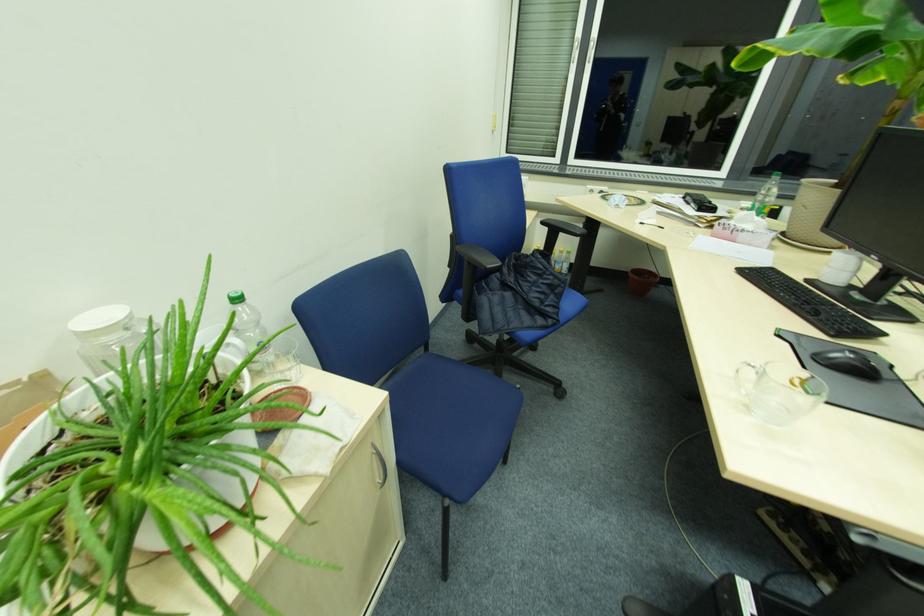
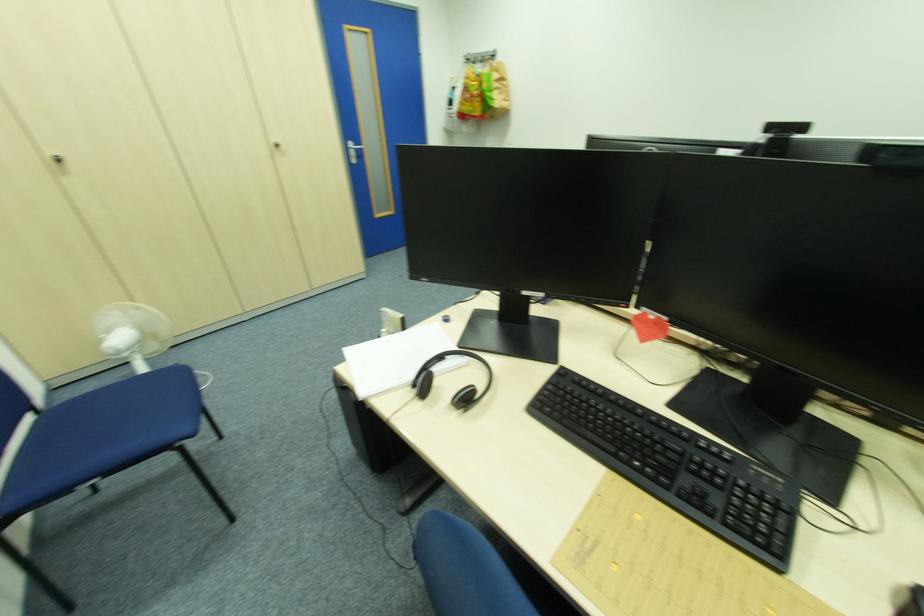
Question: I am providing you with two images of the same scene from different viewpoints. Please identify which objects are invisible in image2.

Choices:
 (A) black webcam
 (B) clear glass mug handle
 (C) blue cooking pot
 (D) silver door handle

Answer: (B)